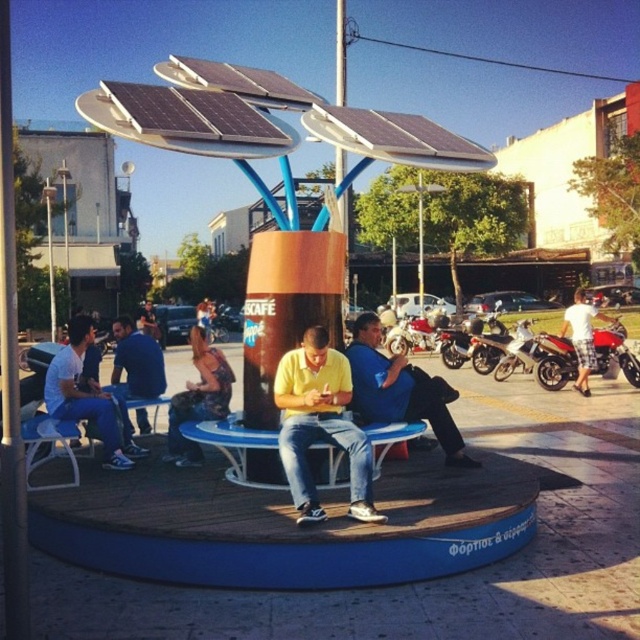
You are planning to place a small table between the blue plastic bench at center and the light blue jeans at center. Given that the table requires 30 feet of space, will there be enough room?

The blue plastic bench at center and the light blue jeans at center are 27.52 feet apart from each other. Since the required space for the table is 30 feet, there is insufficient room to place the table between them.

You are a person who wants to sit on the blue plastic bench at center. However, you are wearing the blue denim jeans at left. Can you comfortably sit on the bench without bending down?

The blue plastic bench at center has a lesser height compared to blue denim jeans at left. Since the bench is shorter than the jeans, you might need to bend down slightly to sit, but it should still be possible.